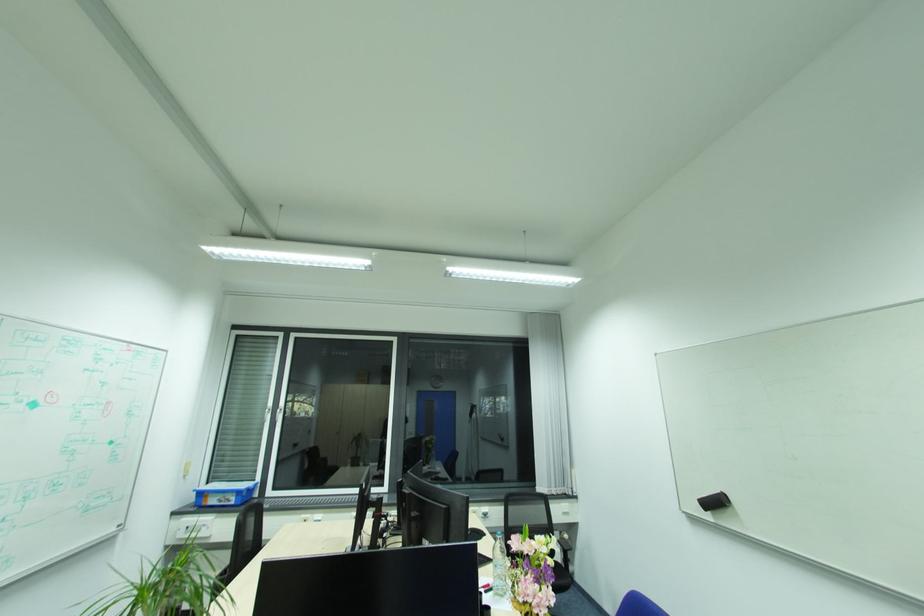
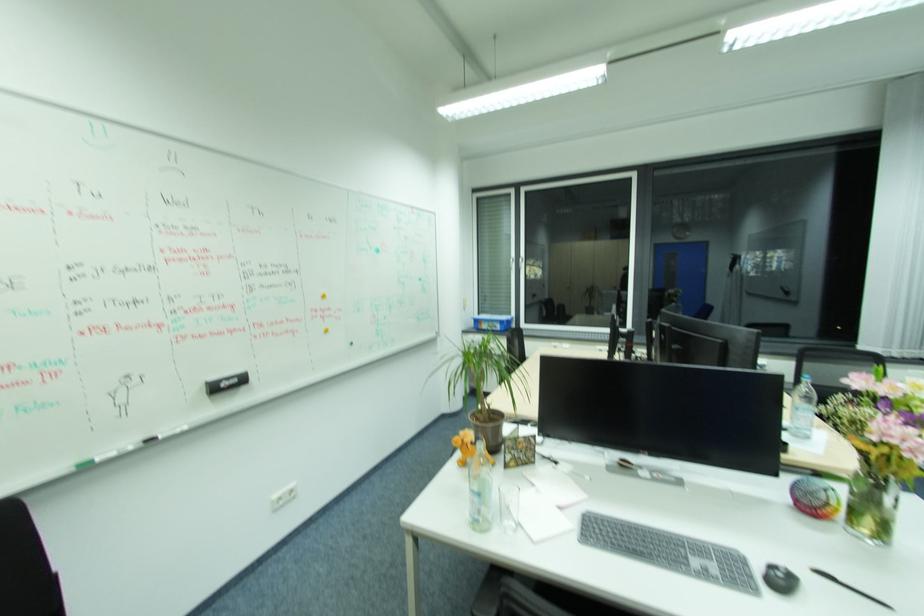
Based on the continuous images, in which direction is the camera rotating?

The camera rotated toward left-down.